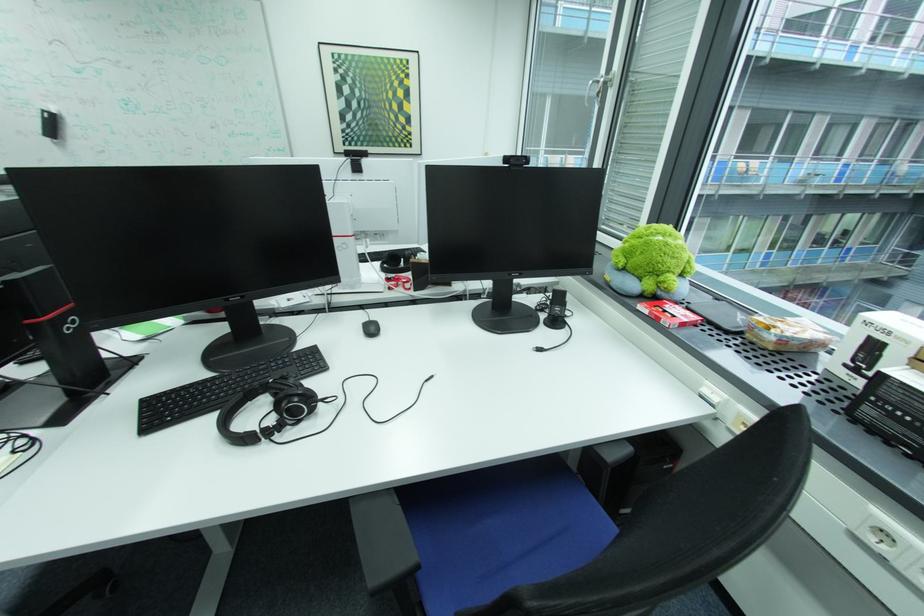
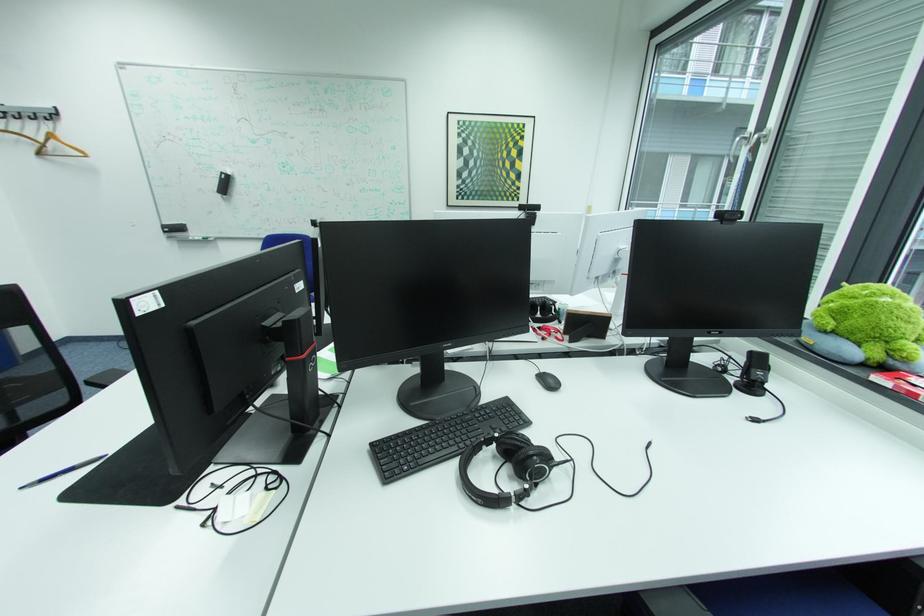
Where in the second image is the point corresponding to point (381, 329) from the first image?

(560, 382)